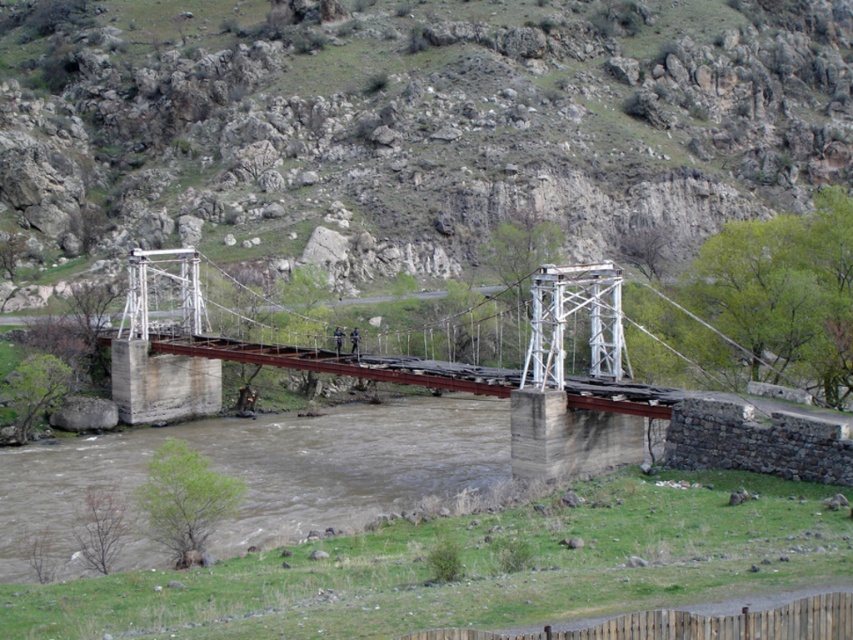
Is green grassy hillside at upper center to the left of rusty metal bridge at center from the viewer's perspective?

Incorrect, green grassy hillside at upper center is not on the left side of rusty metal bridge at center.

Who is positioned more to the right, green grassy hillside at upper center or rusty metal bridge at center?

green grassy hillside at upper center is more to the right.

Who is more forward, (434, 8) or (547, 381)?

Point (547, 381)

Identify the location of green grassy hillside at upper center. This screenshot has height=640, width=853. (416, 120).